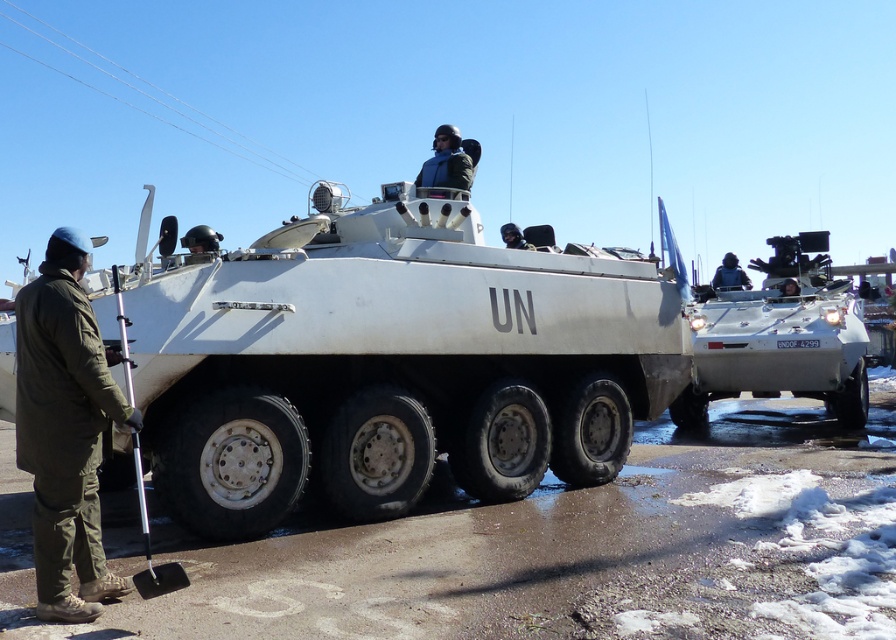
You are a UN peacekeeper assigned to maintain the APCs. You need to reach the green matte uniform at left to retrieve a tool. Given that your maximum comfortable walking distance is 4 meters, can you reach it without straining?

The green matte uniform at left is 4.17 meters away from the camera, which exceeds your maximum comfortable walking distance of 4 meters. Therefore, you would need to strain to reach it.

You are a UN peacekeeper standing near the white matte armored vehicle at center and the silver metallic armored vehicle at center. You need to determine which one requires more space for maintenance. Which vehicle would you say needs more vertical clearance?

The white matte armored vehicle at center is taller than the silver metallic armored vehicle at center, so it requires more vertical clearance for maintenance.

Based on the photo, you are a UN peacekeeper observing the scene. You notice the dark blue uniform at center and the metallic helmet at upper center. Which object is closer to you?

The dark blue uniform at center is closer to you because it is positioned over the metallic helmet at upper center, indicating it is in front.